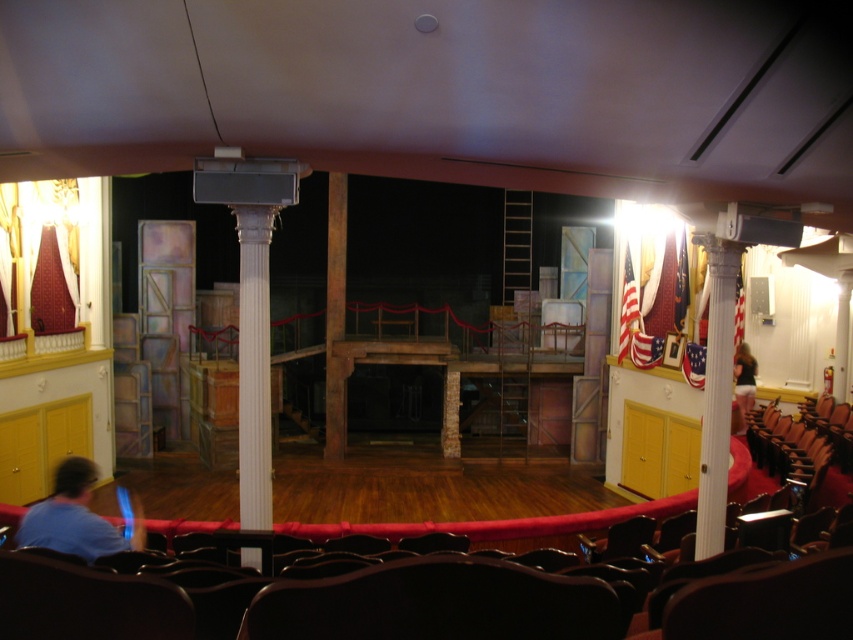
Does white glossy column at right have a smaller size compared to dark brown leather jacket at upper right?

Indeed, white glossy column at right has a smaller size compared to dark brown leather jacket at upper right.

The image size is (853, 640). I want to click on white glossy column at right, so click(717, 394).

Find the location of a particular element. The height and width of the screenshot is (640, 853). white glossy column at right is located at coordinates (717, 394).

Which is behind, point (723, 342) or point (73, 458)?

Positioned behind is point (73, 458).

This screenshot has width=853, height=640. I want to click on white glossy column at right, so click(x=717, y=394).

Does blue shirt at lower left have a smaller size compared to dark brown leather jacket at upper right?

Yes, blue shirt at lower left is smaller than dark brown leather jacket at upper right.

Between blue shirt at lower left and dark brown leather jacket at upper right, which one appears on the right side from the viewer's perspective?

dark brown leather jacket at upper right is more to the right.

Is point (97, 536) behind point (751, 385)?

No, it is in front of (751, 385).

I want to click on blue shirt at lower left, so click(x=76, y=516).